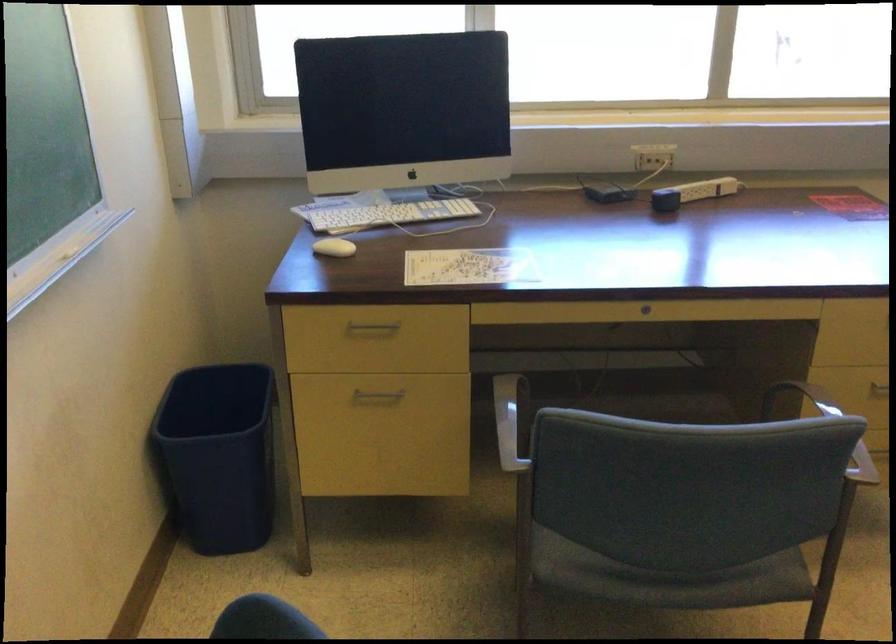
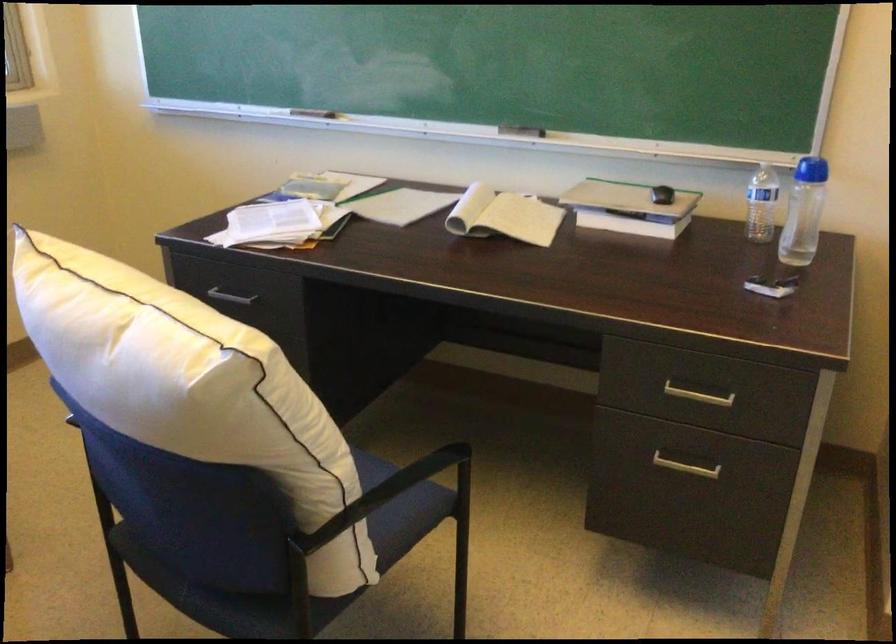
Question: The camera is either moving clockwise (left) or counter-clockwise (right) around the object. The first image is from the beginning of the video and the second image is from the end. Is the camera moving left or right when shooting the video?

Choices:
 (A) Left
 (B) Right

Answer: (A)